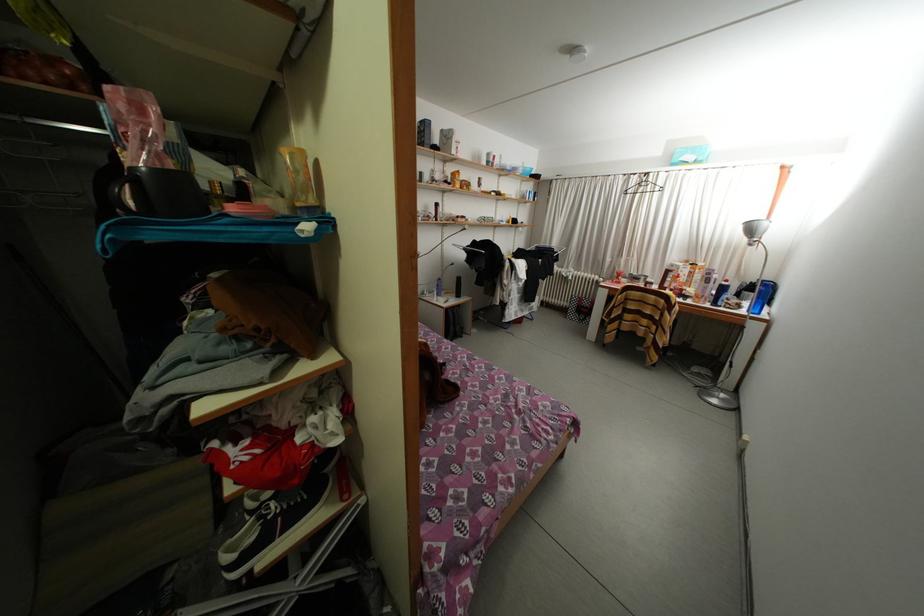
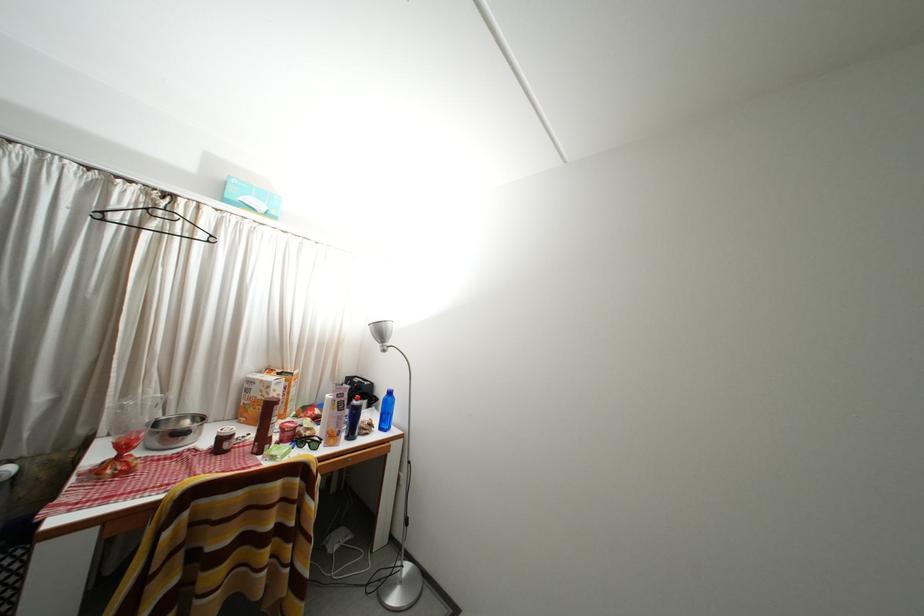
Where in the second image is the point corresponding to (x=679, y=270) from the first image?

(259, 387)